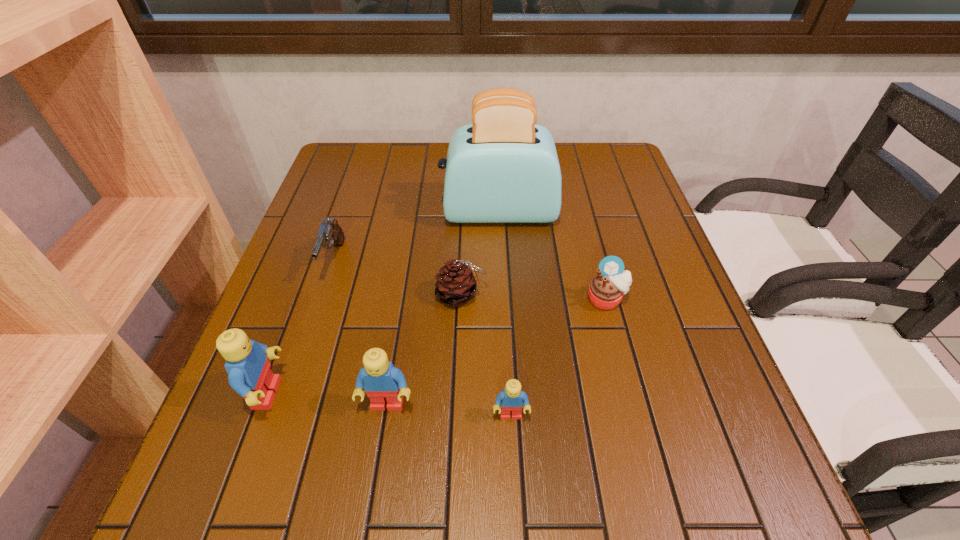
In the image, there is a desktop. Where is `blank space at the far edge`? Image resolution: width=960 pixels, height=540 pixels. blank space at the far edge is located at coordinates (567, 180).

Locate an element on the screen. vacant region at the near edge of the desktop is located at coordinates (401, 430).

Where is `free region at the left edge of the desktop`? The width and height of the screenshot is (960, 540). free region at the left edge of the desktop is located at coordinates (323, 327).

Where is `vacant space at the right edge of the desktop`? vacant space at the right edge of the desktop is located at coordinates (631, 339).

The height and width of the screenshot is (540, 960). I want to click on vacant region at the far left corner, so click(x=348, y=176).

Identify the location of vacant space at the far right corner. (574, 145).

At what (x,y) coordinates should I click in order to perform the action: click on free space that is in between the rightmost Lego and the pinecone. Please return your answer as a coordinate pair (x, y). This screenshot has height=540, width=960. Looking at the image, I should click on coord(486,355).

This screenshot has height=540, width=960. Identify the location of vacant area that lies between the pinecone and the pistol. (397, 278).

You are a GUI agent. You are given a task and a screenshot of the screen. Output one action in this format:
    pyautogui.click(x=<x>, y=<y>)
    Task: Click on the free space between the rightmost object and the farthest object
    This screenshot has width=960, height=540.
    Given the screenshot: What is the action you would take?
    pyautogui.click(x=552, y=255)

I want to click on vacant area between the pinecone and the rightmost object, so click(534, 297).